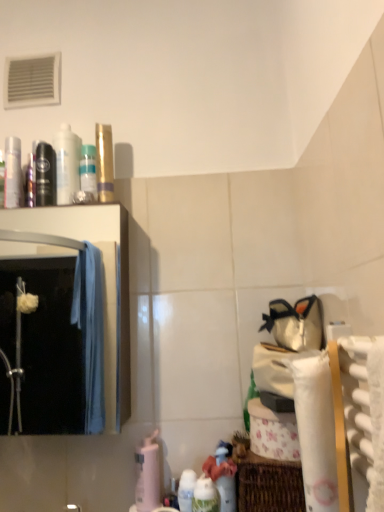
Question: Considering the relative sizes of black matte mouthwash at left, the second mouthwash viewed from the left, and white glossy bottle at lower center, the second cleaning product from the right, in the image provided, is black matte mouthwash at left, the second mouthwash viewed from the left, taller than white glossy bottle at lower center, the second cleaning product from the right,?

Choices:
 (A) no
 (B) yes

Answer: (A)

Question: Is the depth of black matte mouthwash at left, the second mouthwash viewed from the left, greater than that of white glossy bottle at lower center, which is counted as the 2th cleaning product, starting from the left?

Choices:
 (A) yes
 (B) no

Answer: (A)

Question: From a real-world perspective, is black matte mouthwash at left, the second mouthwash viewed from the left, located higher than white glossy bottle at lower center, which is the 2th cleaning product from front to back?

Choices:
 (A) no
 (B) yes

Answer: (B)

Question: Is the position of black matte mouthwash at left, the second mouthwash viewed from the left, less distant than that of white glossy bottle at lower center, the second cleaning product from the right?

Choices:
 (A) no
 (B) yes

Answer: (A)

Question: Can you confirm if black matte mouthwash at left, which is the 3th mouthwash in right-to-left order, is thinner than white glossy bottle at lower center, which is counted as the 2th cleaning product, starting from the left?

Choices:
 (A) no
 (B) yes

Answer: (A)

Question: From the image's perspective, is black matte mouthwash at left, the second mouthwash viewed from the left, on white glossy bottle at lower center, which is counted as the 2th cleaning product, starting from the left?

Choices:
 (A) no
 (B) yes

Answer: (B)

Question: Is white textured bath towel at right taller than gold metallic tube at upper center?

Choices:
 (A) yes
 (B) no

Answer: (B)

Question: Is gold metallic tube at upper center surrounded by white textured bath towel at right?

Choices:
 (A) yes
 (B) no

Answer: (B)

Question: Is white textured bath towel at right to the right of gold metallic tube at upper center from the viewer's perspective?

Choices:
 (A) no
 (B) yes

Answer: (B)

Question: From the image's perspective, would you say white textured bath towel at right is shown under gold metallic tube at upper center?

Choices:
 (A) yes
 (B) no

Answer: (A)

Question: Can you confirm if white textured bath towel at right is shorter than gold metallic tube at upper center?

Choices:
 (A) yes
 (B) no

Answer: (A)

Question: Considering the relative sizes of white textured bath towel at right and gold metallic tube at upper center in the image provided, is white textured bath towel at right smaller than gold metallic tube at upper center?

Choices:
 (A) no
 (B) yes

Answer: (A)

Question: Does white glossy bottle at lower center, which is the second cleaning product from back to front, appear on the left side of gold metallic tube at upper center?

Choices:
 (A) yes
 (B) no

Answer: (B)